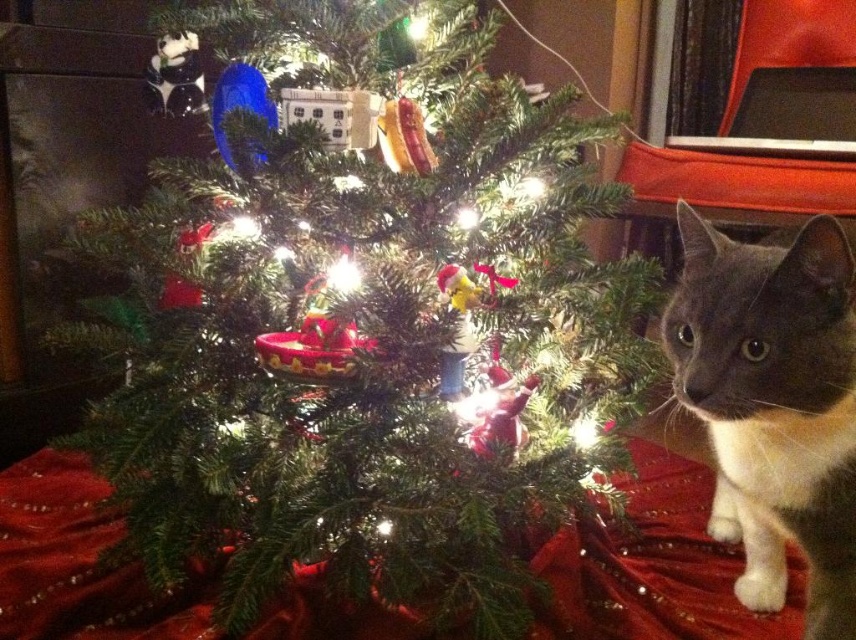
You are planning to place a new ornament on the green matte christmas tree at center. Considering the size of the gray fur cat at right, will the tree be able to hold the ornament without the cat knocking it over?

The green matte christmas tree at center is bigger than the gray fur cat at right, so it should be stable enough to hold the ornament without the cat knocking it over.

You are standing in front of the Christmas tree and want to place a gift box at point (x=212, y=12) and another gift box at point (x=777, y=387). Which gift box will be closer to the camera?

The gift box at point (x=777, y=387) will be closer to the camera because point (x=212, y=12) is behind point (x=777, y=387).